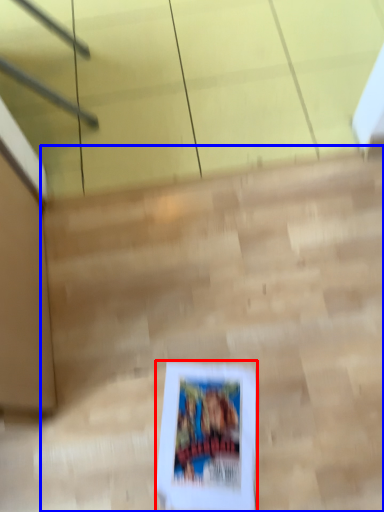
Question: Which object appears farthest to the camera in this image, picture frame (highlighted by a red box) or stairwell (highlighted by a blue box)?

Choices:
 (A) picture frame
 (B) stairwell

Answer: (A)